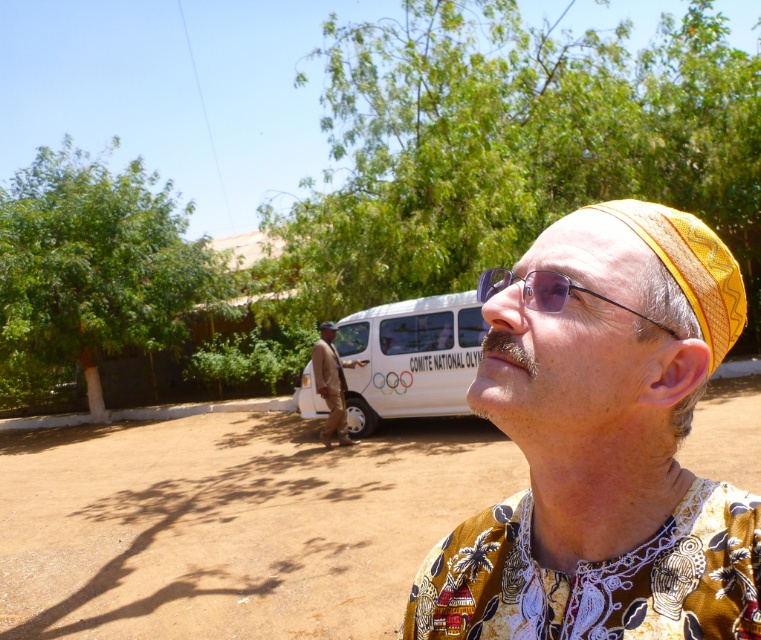
Question: Can you confirm if green leafy tree at upper left is positioned below brown leather jacket at center?

Choices:
 (A) yes
 (B) no

Answer: (B)

Question: Does brown sandy dirt at lower center have a greater width compared to brown leather jacket at center?

Choices:
 (A) no
 (B) yes

Answer: (B)

Question: Based on their relative distances, which object is farther from the white van at center?

Choices:
 (A) yellow woven hat at upper right
 (B) yellow printed fabric headband at center

Answer: (B)

Question: Among these points, which one is farthest from the camera?

Choices:
 (A) (416, 445)
 (B) (374, 212)
 (C) (603, 349)
 (D) (584, 218)

Answer: (B)

Question: Does yellow woven hat at upper right have a larger size compared to transparent plastic glasses at center?

Choices:
 (A) yes
 (B) no

Answer: (A)

Question: Which point appears farthest from the camera in this image?

Choices:
 (A) (610, 262)
 (B) (24, 250)
 (C) (371, 326)
 (D) (330, 378)

Answer: (B)